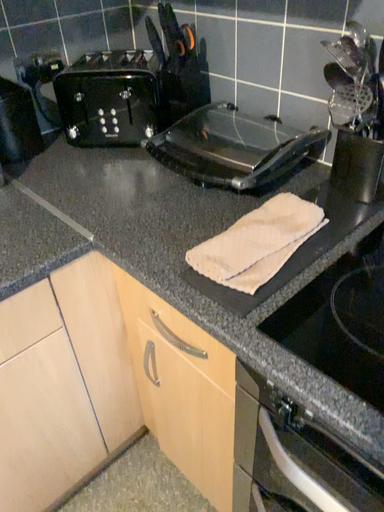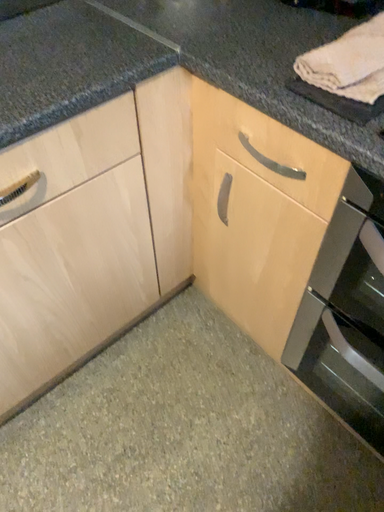
Question: Which way did the camera rotate in the video?

Choices:
 (A) rotated upward
 (B) rotated downward

Answer: (B)